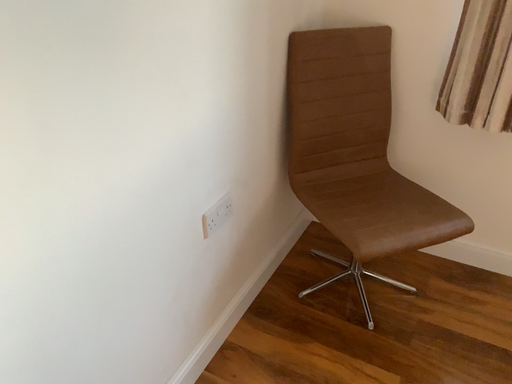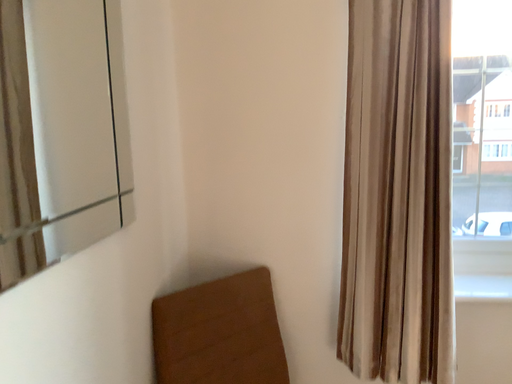
Question: How did the camera likely rotate when shooting the video?

Choices:
 (A) rotated right
 (B) rotated left

Answer: (A)